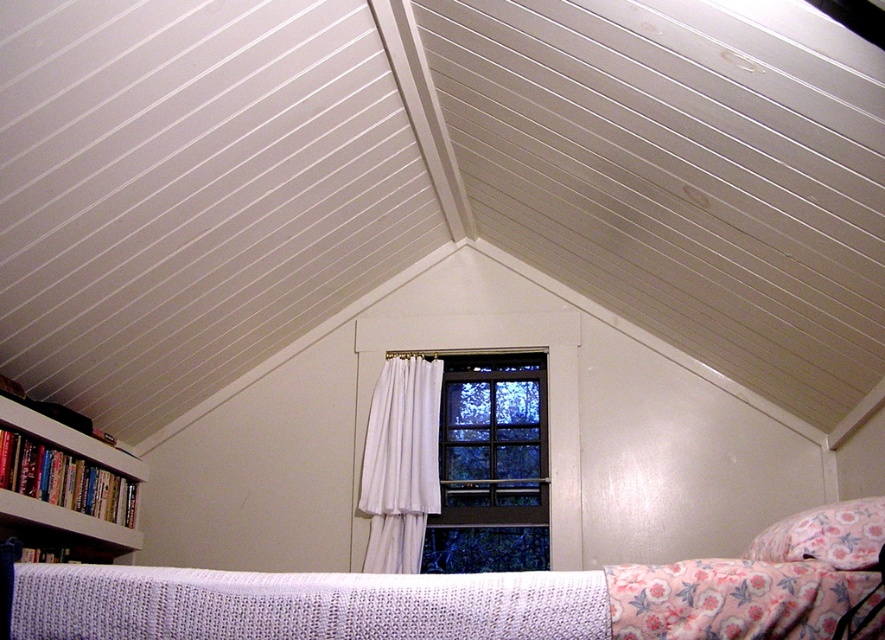
You are planning to hang a decorative banner that is 1.2 meters wide. You want to place it on the wall where the clear glass window at center and the white sheer curtain at center are located. Considering their sizes, which object can the banner fit better with?

The clear glass window at center is bigger than the white sheer curtain at center, so the banner can fit better with the clear glass window at center.